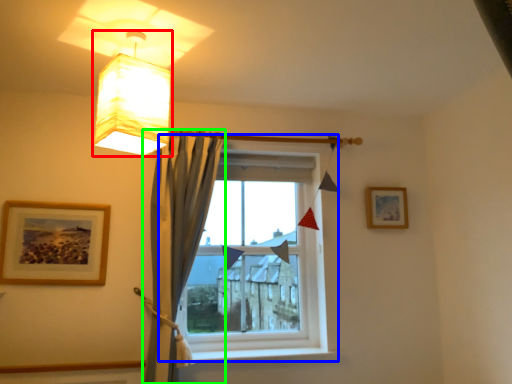
Question: Which is nearer to the lamp (highlighted by a red box)? window (highlighted by a blue box) or curtain (highlighted by a green box).

Choices:
 (A) window
 (B) curtain

Answer: (B)